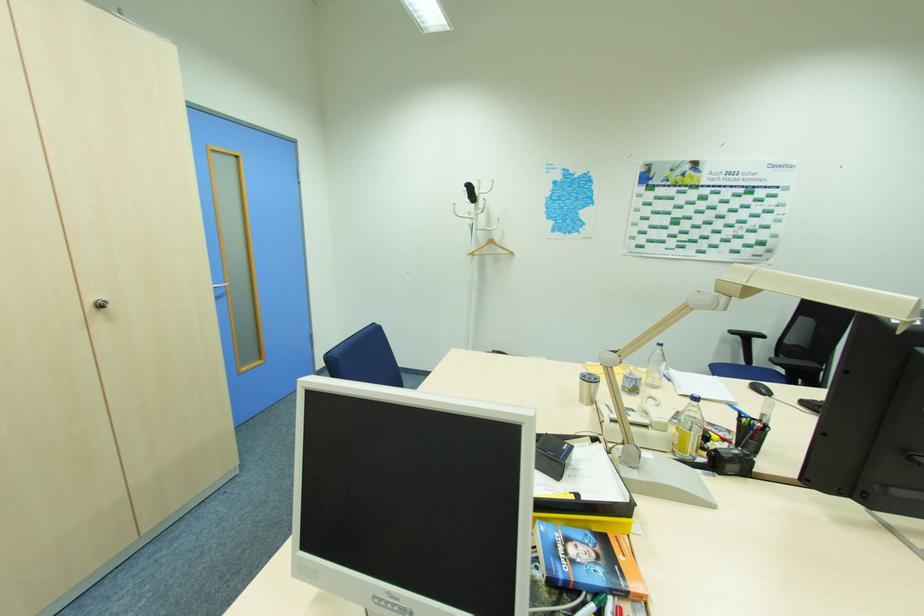
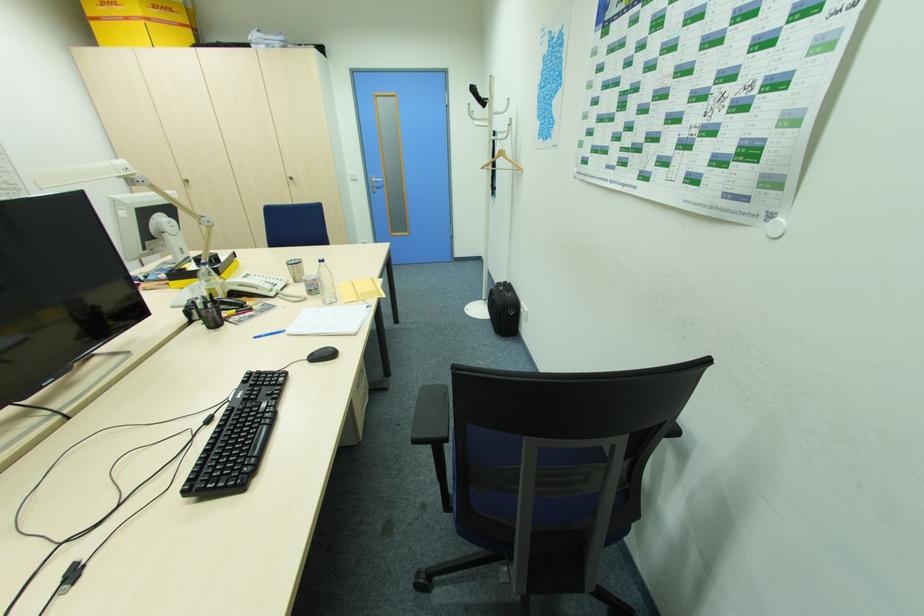
Where in the second image is the point corresponding to pixel 472 254 from the first image?

(485, 168)